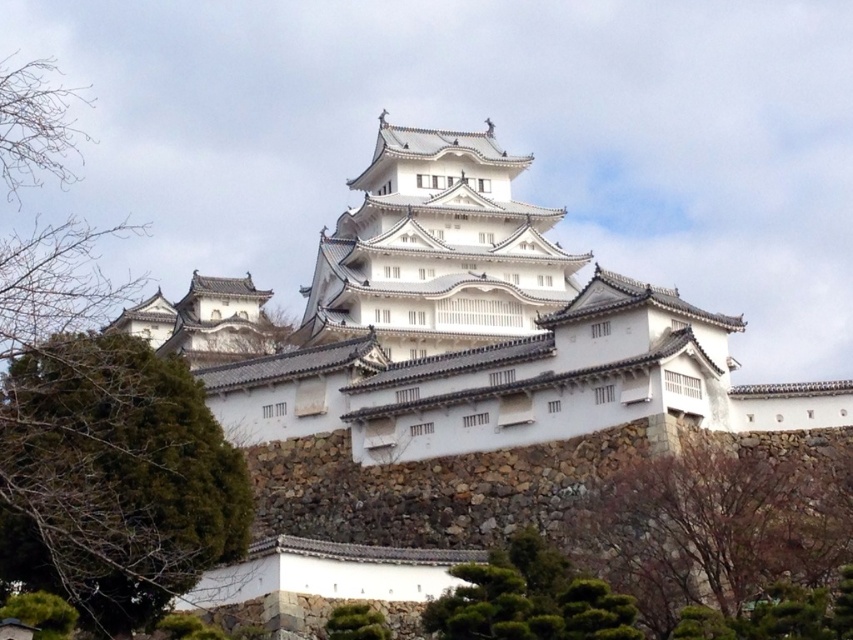
You are a visitor at Himeji Castle and notice two trees in the courtyard. One is the brown textured tree at lower right and the other is the green leafy tree at lower center. Which tree is taller?

The brown textured tree at lower right is taller than the green leafy tree at lower center.

You are a tourist standing in front of Himeji Castle and want to take a photo. The castle is at point (461,326). If you want to include both the castle and the evergreen tree on the left in your photo, where should you position yourself relative to the castle?

To include both the white stone castle at center located at point (461,326) and the evergreen tree on the left in your photo, you should position yourself to the left of the castle so that both elements are within the frame.

You are a visitor at Himeji Castle and want to take a photo that includes both the green leafy tree at center and the green leafy tree at lower center. Which tree should you position closer to the camera to ensure both are fully visible in the frame?

To ensure both the green leafy tree at center and the green leafy tree at lower center are fully visible in the frame, position the green leafy tree at lower center closer to the camera since it is wider than the green leafy tree at center.